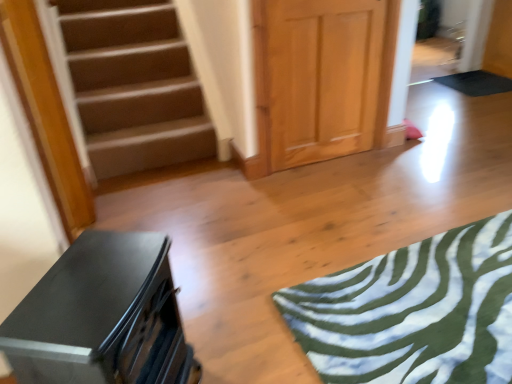
The height and width of the screenshot is (384, 512). What are the coordinates of `empty space that is in between light wood paneling at center and matte black dresser at lower left` in the screenshot? It's located at (279, 236).